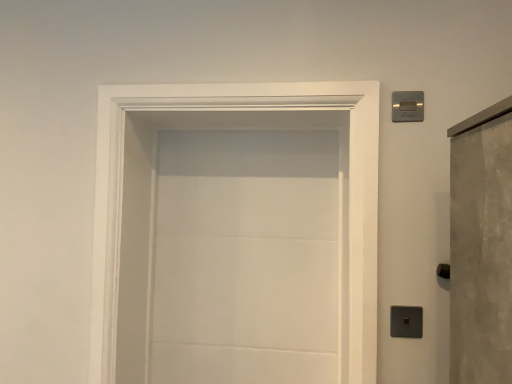
Question: In terms of width, does satin silver switch at upper right look wider or thinner when compared to white matte door at center?

Choices:
 (A) thin
 (B) wide

Answer: (A)

Question: Is satin silver switch at upper right inside the boundaries of white matte door at center, or outside?

Choices:
 (A) outside
 (B) inside

Answer: (A)

Question: Is point (411, 114) positioned closer to the camera than point (182, 114)?

Choices:
 (A) closer
 (B) farther

Answer: (A)

Question: Looking at the image, does white matte door at center seem bigger or smaller compared to satin silver switch at upper right?

Choices:
 (A) small
 (B) big

Answer: (B)

Question: From the image's perspective, is white matte door at center positioned above or below satin silver switch at upper right?

Choices:
 (A) below
 (B) above

Answer: (A)

Question: From a real-world perspective, relative to satin silver switch at upper right, is white matte door at center vertically above or below?

Choices:
 (A) above
 (B) below

Answer: (B)

Question: Is white matte door at center wider or thinner than satin silver switch at upper right?

Choices:
 (A) wide
 (B) thin

Answer: (A)